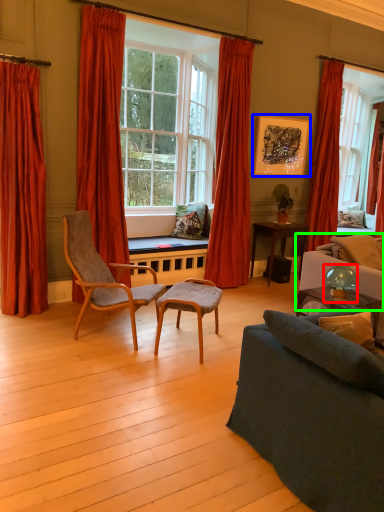
Question: Which is nearer to the lamp (highlighted by a red box)? picture frame (highlighted by a blue box) or couch (highlighted by a green box).

Choices:
 (A) picture frame
 (B) couch

Answer: (B)